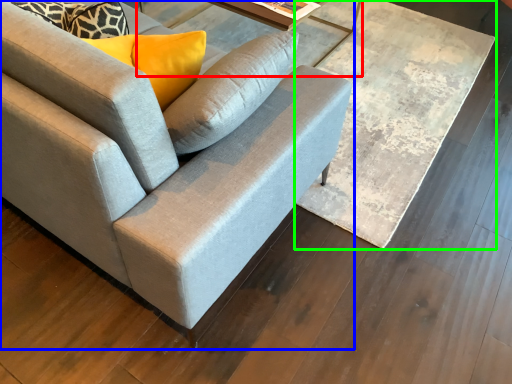
Question: Which is nearer to the round table (highlighted by a red box)? studio couch (highlighted by a blue box) or table (highlighted by a green box).

Choices:
 (A) studio couch
 (B) table

Answer: (B)